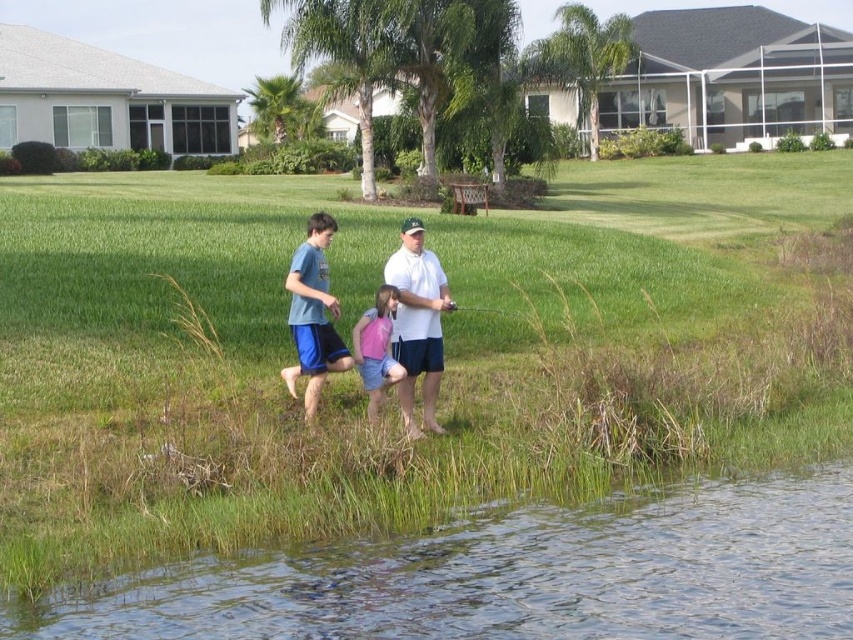
You are standing at the edge of the water and want to place a small picnic basket on the green grass at center. Based on the coordinates provided, can you confirm if the green grass at center is exactly at point (x=393, y=394)?

Yes, the green grass at center is exactly located at point (x=393, y=394) as stated in the description.

From the picture: You are a photographer trying to capture a clear shot of the pink fabric dress at center without the white matte shirt at center blocking it. Can you adjust your angle to do so?

The white matte shirt at center is positioned over the pink fabric dress at center, so adjusting your angle might not be possible as the white matte shirt is blocking the view of the pink fabric dress.

You are standing at the center of the scene and want to walk to the clear water at lower left. Which direction should you move in?

To reach the clear water at lower left, you should move towards the lower left direction from your current position at the center of the scene.